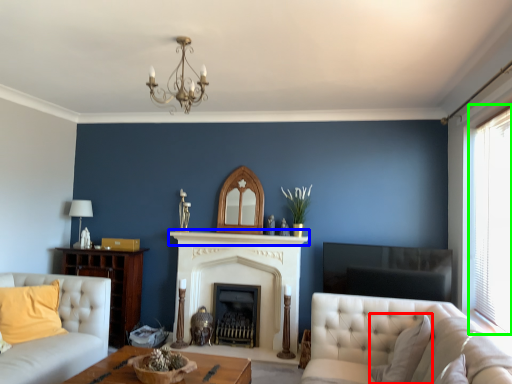
Question: Estimate the real-world distances between objects in this image. Which object is closer to pillow (highlighted by a red box), mantle (highlighted by a blue box) or window (highlighted by a green box)?

Choices:
 (A) mantle
 (B) window

Answer: (B)